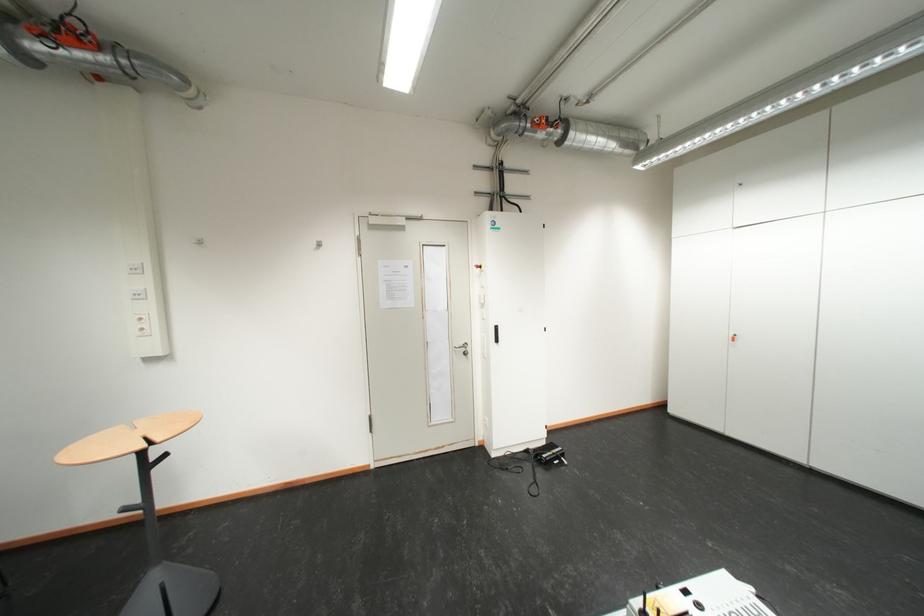
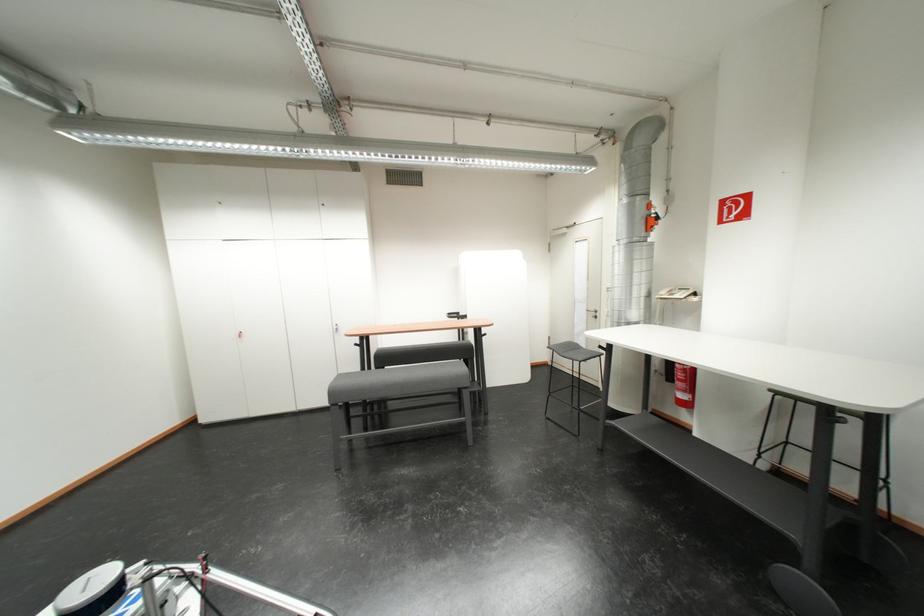
Question: The camera is either moving clockwise (left) or counter-clockwise (right) around the object. The first image is from the beginning of the video and the second image is from the end. Is the camera moving left or right when shooting the video?

Choices:
 (A) Left
 (B) Right

Answer: (A)